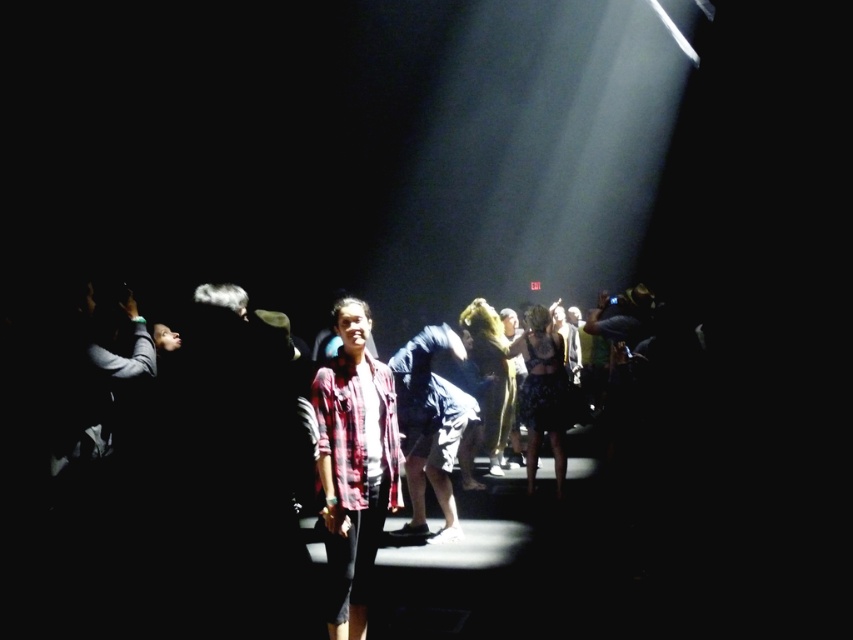
Question: Is plaid fabric shirt at center below denim shorts at center?

Choices:
 (A) yes
 (B) no

Answer: (B)

Question: Which of the following is the closest to the observer?

Choices:
 (A) (450, 412)
 (B) (363, 568)

Answer: (B)

Question: Can you confirm if plaid fabric shirt at center is positioned below denim shorts at center?

Choices:
 (A) no
 (B) yes

Answer: (A)

Question: Which point appears farthest from the camera in this image?

Choices:
 (A) (379, 420)
 (B) (434, 401)

Answer: (B)

Question: Which of the following is the closest to the observer?

Choices:
 (A) (398, 444)
 (B) (445, 483)

Answer: (A)

Question: Can you confirm if plaid fabric shirt at center is positioned to the right of denim shorts at center?

Choices:
 (A) no
 (B) yes

Answer: (A)